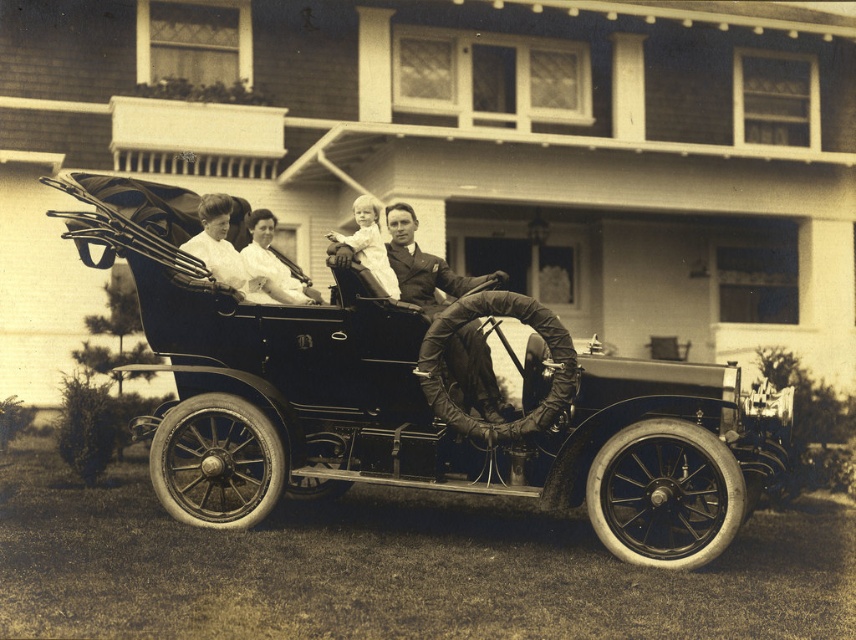
You are standing in front of the vintage scene. There is a point at coordinates point (417, 403). What is located at this point?

At point (417, 403) lies a polished wood car at center.

You are a photographer analyzing the vintage scene. The polished wood car at center is positioned in the image. Where exactly is it located in terms of coordinates?

The polished wood car at center is located at point (417,403).